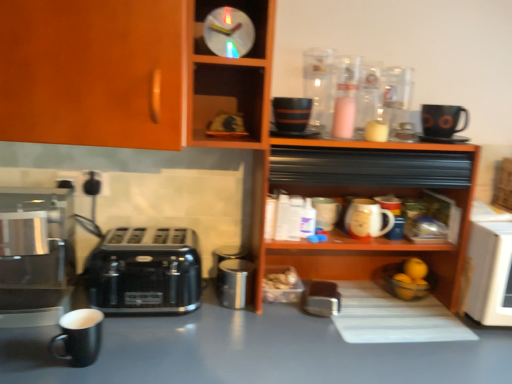
This screenshot has height=384, width=512. Find the location of `vacant space behind black matte mug at lower left`. vacant space behind black matte mug at lower left is located at coordinates (128, 326).